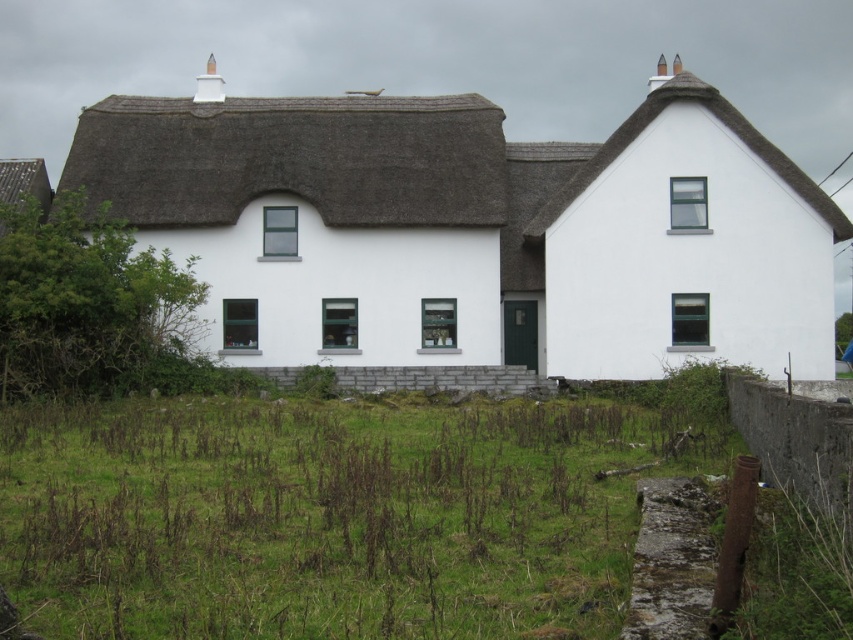
Question: Among these points, which one is farthest from the camera?

Choices:
 (A) (531, 573)
 (B) (538, 230)

Answer: (B)

Question: Does white thatched roof cottage at center appear on the right side of thatched roof at upper right?

Choices:
 (A) no
 (B) yes

Answer: (A)

Question: Which object is closer to the camera taking this photo?

Choices:
 (A) green grass at lower center
 (B) white thatched roof cottage at center

Answer: (A)

Question: Among these points, which one is farthest from the camera?

Choices:
 (A) (830, 218)
 (B) (460, 470)
 (C) (737, 230)

Answer: (C)

Question: Is white thatched roof cottage at center above green grass at lower center?

Choices:
 (A) no
 (B) yes

Answer: (B)

Question: Where is white thatched roof cottage at center located in relation to green grass at lower center in the image?

Choices:
 (A) above
 (B) below

Answer: (A)